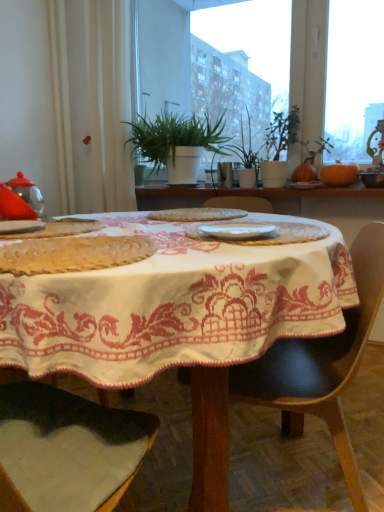
Find the location of `free point above orange matte pumpkin at upper right (from a real-world perspective)`. free point above orange matte pumpkin at upper right (from a real-world perspective) is located at coordinates (344, 158).